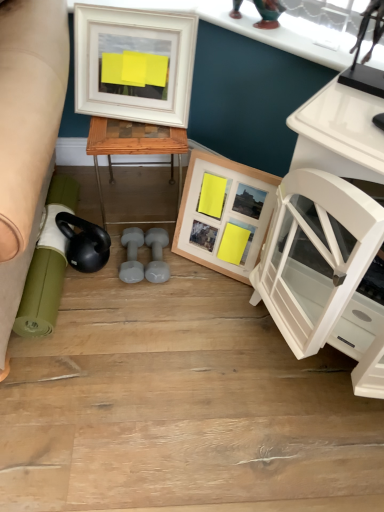
Locate an element on the screen. Image resolution: width=384 pixels, height=512 pixels. free area in between wooden picture frame at center, which ranks as the first picture frame in bottom-to-top order, and gray rubber dumbbell at center, acting as the 2th dumbbell starting from the left is located at coordinates (202, 275).